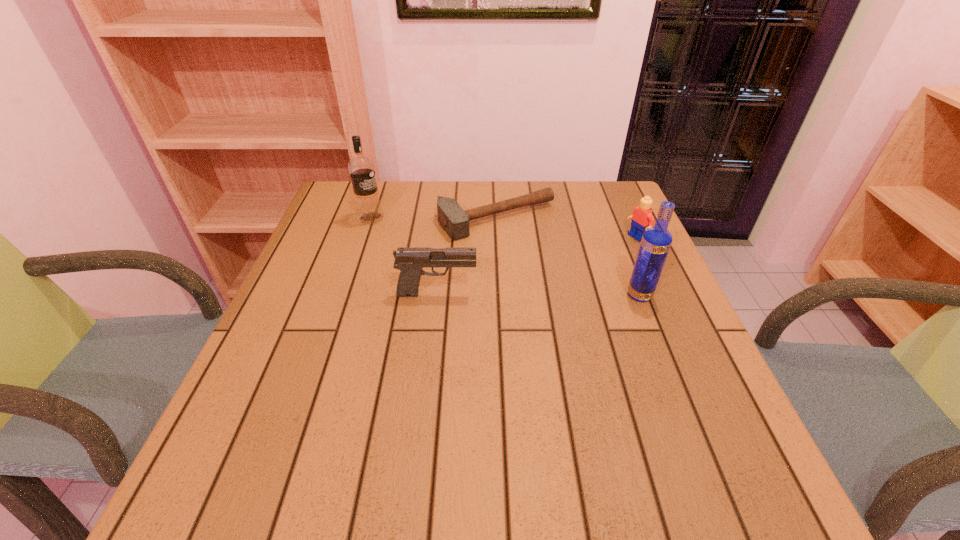
You are a GUI agent. You are given a task and a screenshot of the screen. Output one action in this format:
    pyautogui.click(x=<x>, y=<y>)
    Task: Click on the free space on the desktop that is between the pistol and the nearer vodka and is positioned on the label of the left vodka
    This screenshot has height=540, width=960.
    Given the screenshot: What is the action you would take?
    pyautogui.click(x=531, y=294)

The height and width of the screenshot is (540, 960). Find the location of `free space on the desktop that is between the pistol and the nearer vodka and is positioned on the striking surface of the shortest object`. free space on the desktop that is between the pistol and the nearer vodka and is positioned on the striking surface of the shortest object is located at coordinates (566, 295).

Locate an element on the screen. The height and width of the screenshot is (540, 960). vacant spot on the desktop that is between the pistol and the right vodka and is positioned on the face of the Lego is located at coordinates (512, 294).